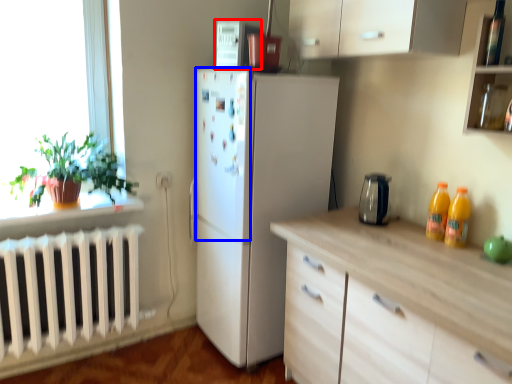
Question: Which of the following is the farthest to the observer, appliance (highlighted by a red box) or screen door (highlighted by a blue box)?

Choices:
 (A) appliance
 (B) screen door

Answer: (A)